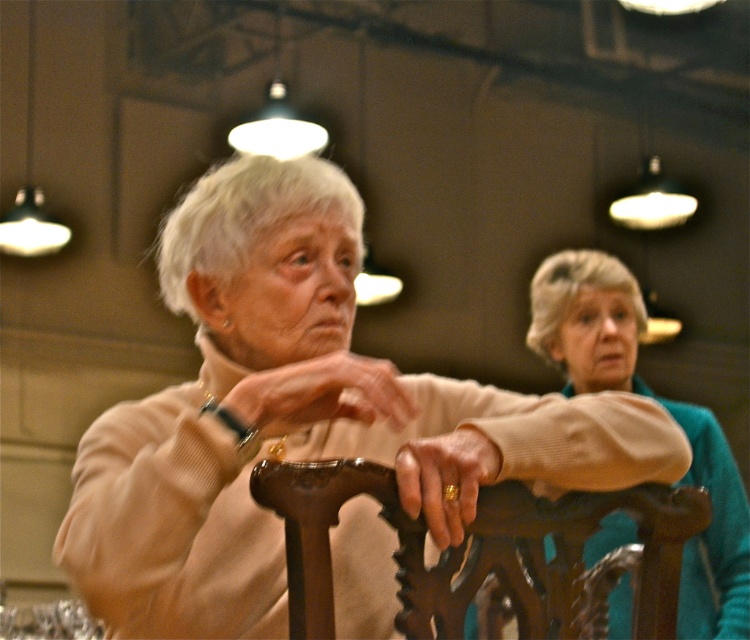
Question: Among these points, which one is farthest from the camera?

Choices:
 (A) (514, 577)
 (B) (470, 436)
 (C) (537, 285)

Answer: (C)

Question: Can you confirm if polished wood chair at center is positioned below smooth beige hand at center?

Choices:
 (A) no
 (B) yes

Answer: (B)

Question: Which object is closer to the camera taking this photo?

Choices:
 (A) smooth beige hand at center
 (B) teal sweater at center

Answer: (A)

Question: Estimate the real-world distances between objects in this image. Which object is closer to the teal sweater at center?

Choices:
 (A) gold metallic ring at center
 (B) polished wood chair at center

Answer: (B)

Question: Is smooth beige hand at center smaller than gold metallic ring at center?

Choices:
 (A) no
 (B) yes

Answer: (A)

Question: Is teal sweater at center smaller than smooth beige hand at center?

Choices:
 (A) yes
 (B) no

Answer: (B)